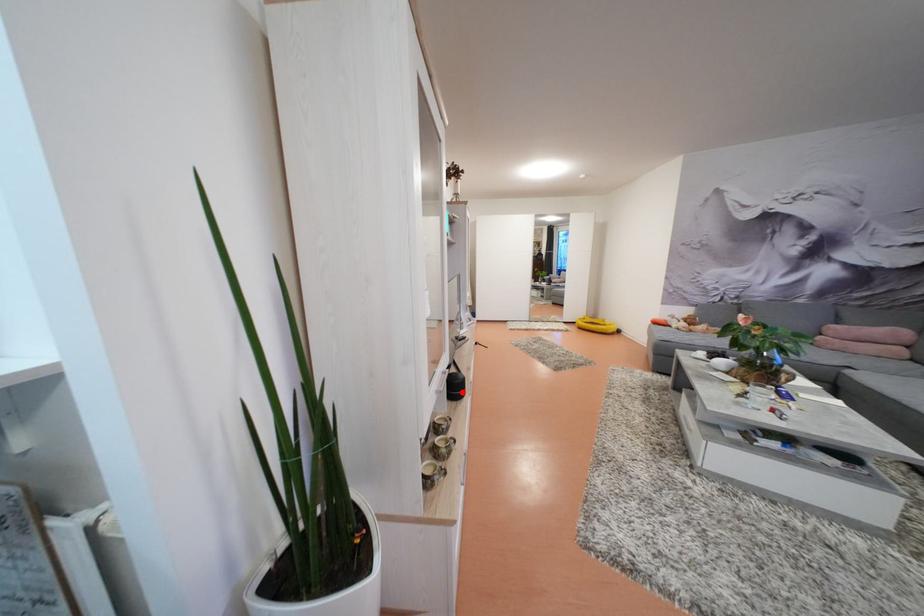
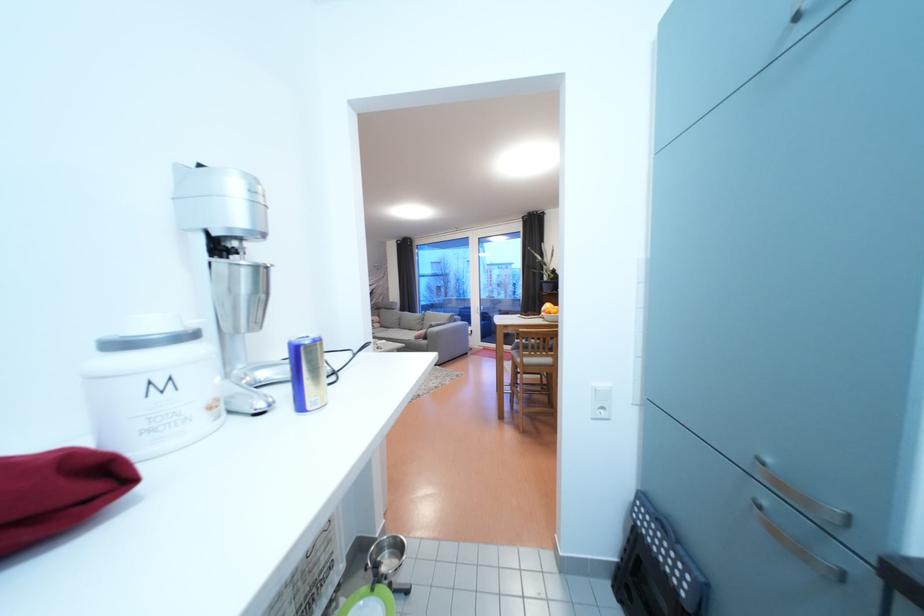
Question: I am providing you with two images of the same scene from different viewpoints. A red point is marked on the first image. At the location where the point appears in image 1, is it still visible in image 2?

Choices:
 (A) Yes
 (B) No

Answer: (B)